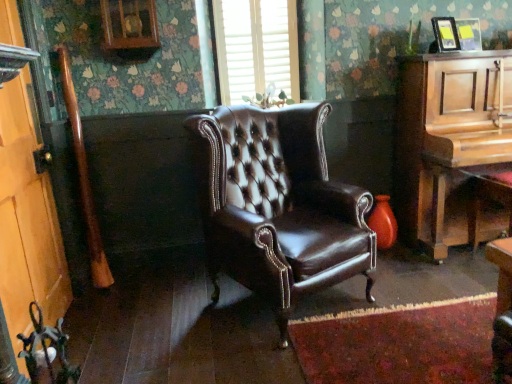
Question: Is wooden piano at right oriented towards wooden door at left?

Choices:
 (A) yes
 (B) no

Answer: (B)

Question: Is wooden piano at right to the left of wooden door at left from the viewer's perspective?

Choices:
 (A) yes
 (B) no

Answer: (B)

Question: Considering the relative positions of wooden piano at right and wooden door at left in the image provided, is wooden piano at right to the right of wooden door at left from the viewer's perspective?

Choices:
 (A) yes
 (B) no

Answer: (A)

Question: Is wooden piano at right positioned behind wooden door at left?

Choices:
 (A) no
 (B) yes

Answer: (B)

Question: From a real-world perspective, is wooden piano at right on top of wooden door at left?

Choices:
 (A) no
 (B) yes

Answer: (A)

Question: Considering the relative sizes of wooden piano at right and wooden door at left in the image provided, is wooden piano at right wider than wooden door at left?

Choices:
 (A) no
 (B) yes

Answer: (B)

Question: Can you confirm if brown leather wingback chair at center is taller than white textured blinds at upper center?

Choices:
 (A) yes
 (B) no

Answer: (A)

Question: Does brown leather wingback chair at center have a greater width compared to white textured blinds at upper center?

Choices:
 (A) yes
 (B) no

Answer: (A)

Question: Is brown leather wingback chair at center in front of white textured blinds at upper center?

Choices:
 (A) no
 (B) yes

Answer: (B)

Question: Does brown leather wingback chair at center come behind white textured blinds at upper center?

Choices:
 (A) no
 (B) yes

Answer: (A)

Question: Considering the relative sizes of brown leather wingback chair at center and white textured blinds at upper center in the image provided, is brown leather wingback chair at center thinner than white textured blinds at upper center?

Choices:
 (A) yes
 (B) no

Answer: (B)

Question: Are brown leather wingback chair at center and white textured blinds at upper center far apart?

Choices:
 (A) yes
 (B) no

Answer: (B)

Question: Is white textured blinds at upper center bigger than wooden door at left?

Choices:
 (A) no
 (B) yes

Answer: (A)